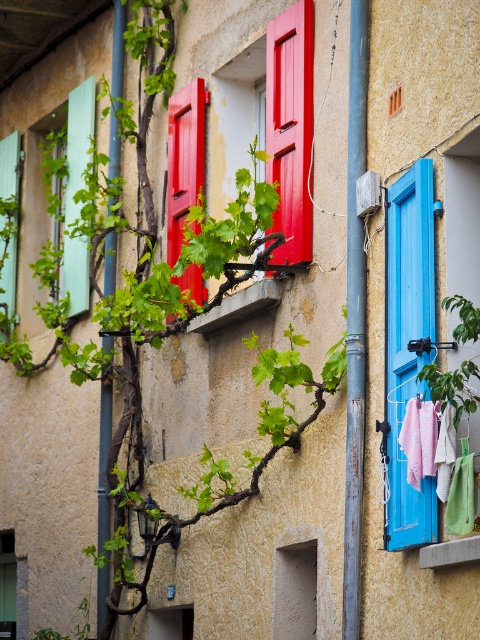
Does matte green shutters at left appear over matte teal shutters at left?

Correct, matte green shutters at left is located above matte teal shutters at left.

Who is lower down, matte green shutters at left or matte teal shutters at left?

matte teal shutters at left

Measure the distance between matte green shutters at left and camera.

37.76 meters

Locate an element on the screen. This screenshot has height=640, width=480. matte green shutters at left is located at coordinates (78, 141).

Is metallic pipe at center positioned before metallic pipe at left?

Yes, it is in front of metallic pipe at left.

Between metallic pipe at center and metallic pipe at left, which one has less height?

Standing shorter between the two is metallic pipe at center.

Who is more distant from viewer, (347, 504) or (104, 616)?

The point (104, 616) is behind.

Where is `metallic pipe at center`? The image size is (480, 640). metallic pipe at center is located at coordinates (355, 321).

Who is shorter, smooth wooden shutter at center or metallic pipe at left?

With less height is smooth wooden shutter at center.

Is point (168, 112) farther from camera compared to point (117, 156)?

No, it is in front of (117, 156).

Does point (192, 113) come in front of point (106, 284)?

Yes.

This screenshot has height=640, width=480. I want to click on smooth wooden shutter at center, so click(x=183, y=160).